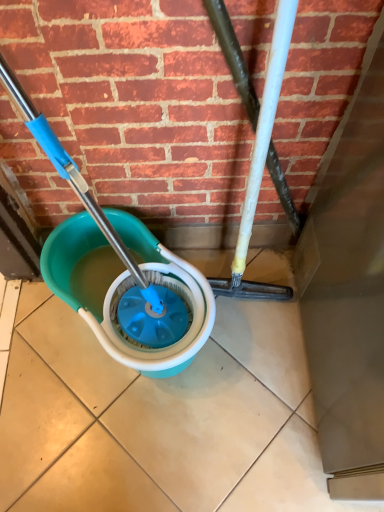
What do you see at coordinates (125, 288) in the screenshot? I see `teal plastic bucket at center` at bounding box center [125, 288].

Measure the distance between teal plastic bucket at center and camera.

teal plastic bucket at center and camera are 34.14 inches apart from each other.

What is the approximate width of teal plastic bucket at center?

It is 19.76 inches.

This screenshot has width=384, height=512. Identify the location of teal plastic bucket at center. (125, 288).

Identify the location of teal plastic bucket at center. (125, 288).